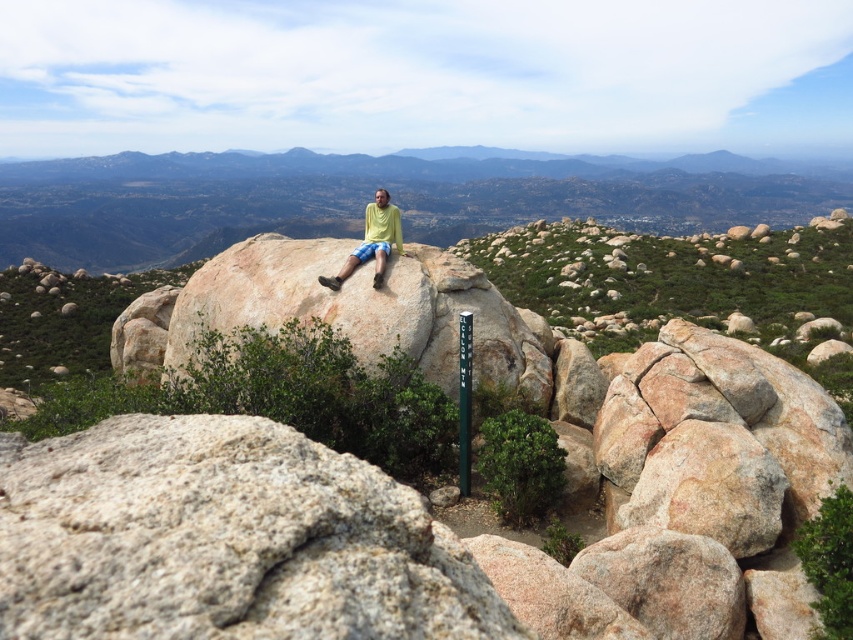
Does gray granite boulder at center appear on the left side of smooth granite boulder at center?

Indeed, gray granite boulder at center is positioned on the left side of smooth granite boulder at center.

Does gray granite boulder at center appear on the right side of smooth granite boulder at center?

No, gray granite boulder at center is not to the right of smooth granite boulder at center.

Locate an element on the screen. The width and height of the screenshot is (853, 640). gray granite boulder at center is located at coordinates (225, 540).

Does gray granite boulder at center have a lesser width compared to matte yellow shirt at center?

Indeed, gray granite boulder at center has a lesser width compared to matte yellow shirt at center.

Between gray granite boulder at center and matte yellow shirt at center, which one has more height?

matte yellow shirt at center is taller.

The height and width of the screenshot is (640, 853). What do you see at coordinates (225, 540) in the screenshot?
I see `gray granite boulder at center` at bounding box center [225, 540].

The image size is (853, 640). Identify the location of gray granite boulder at center. (225, 540).

Between point (843, 168) and point (328, 282), which one is positioned in front?

Positioned in front is point (328, 282).

Find the location of a particular element. The height and width of the screenshot is (640, 853). smooth granite boulder at center is located at coordinates (367, 198).